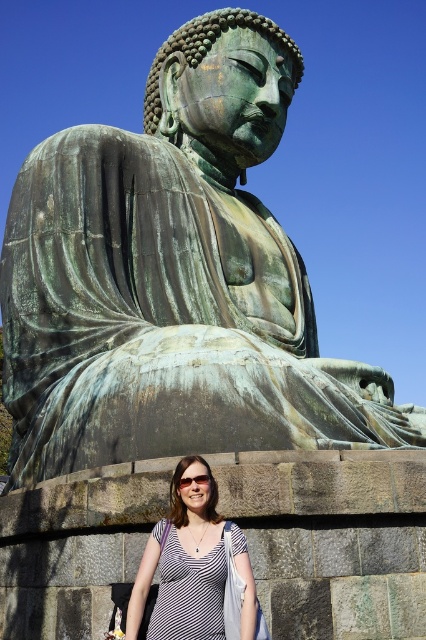
Question: Which object is closer to the camera taking this photo?

Choices:
 (A) transparent plastic goggles at center
 (B) white striped shirt at lower center

Answer: (B)

Question: Which object appears farthest from the camera in this image?

Choices:
 (A) transparent plastic goggles at center
 (B) white striped shirt at lower center

Answer: (A)

Question: From the image, what is the correct spatial relationship of white striped shirt at lower center in relation to transparent plastic goggles at center?

Choices:
 (A) right
 (B) left

Answer: (B)

Question: Can you confirm if white striped shirt at lower center is smaller than transparent plastic goggles at center?

Choices:
 (A) no
 (B) yes

Answer: (B)

Question: Among these points, which one is nearest to the camera?

Choices:
 (A) (196, 577)
 (B) (187, 483)

Answer: (A)

Question: Where is white striped shirt at lower center located in relation to transparent plastic goggles at center in the image?

Choices:
 (A) left
 (B) right

Answer: (A)